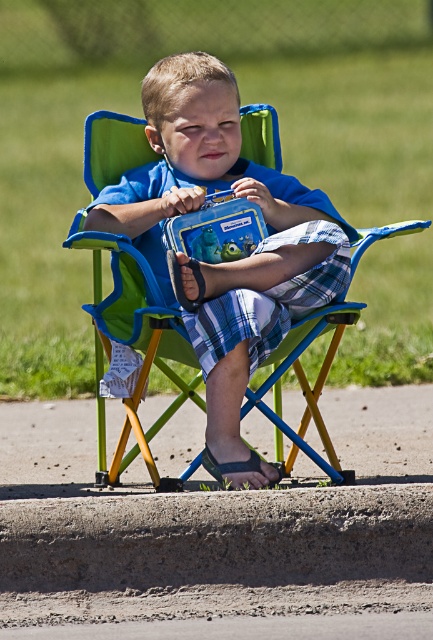
Can you confirm if blue fabric boy at center is taller than black fabric sandal at lower center?

Correct, blue fabric boy at center is much taller as black fabric sandal at lower center.

Who is higher up, blue fabric boy at center or black fabric sandal at lower center?

blue fabric boy at center is higher up.

Which is in front, point (178, 182) or point (202, 456)?

Positioned in front is point (202, 456).

Locate an element on the screen. The image size is (433, 640). blue fabric boy at center is located at coordinates (229, 260).